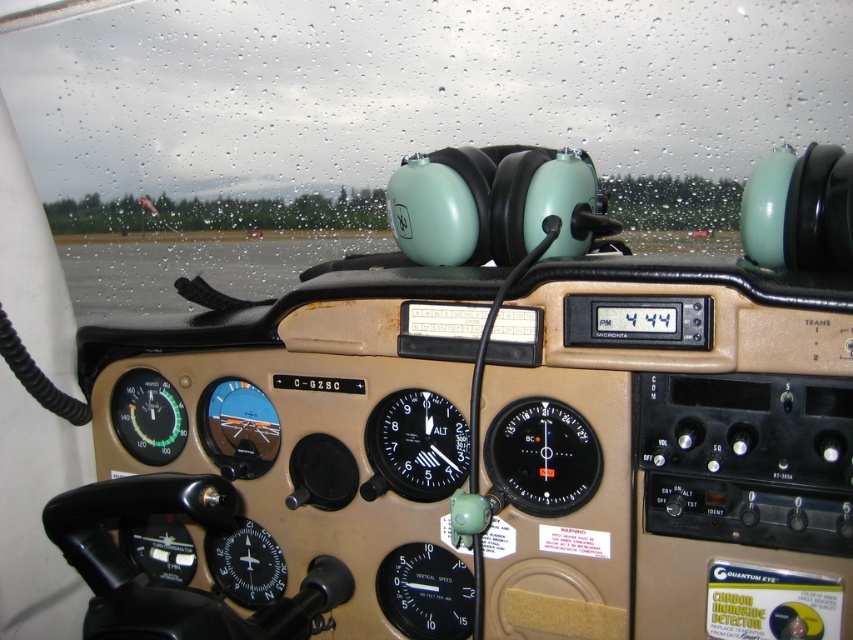
Between black plastic gauge at center and matte black compass at left, which one is positioned lower?

black plastic gauge at center

Between black plastic gauge at center and matte black compass at left, which one appears on the left side from the viewer's perspective?

matte black compass at left

At what (x,y) coordinates should I click in order to perform the action: click on black plastic gauge at center. Please return your answer as a coordinate pair (x, y). This screenshot has height=640, width=853. Looking at the image, I should click on (543, 456).

Locate an element on the screen. The width and height of the screenshot is (853, 640). black plastic gauge at center is located at coordinates (543, 456).

Measure the distance between transparent glass windshield at upper center and black plastic gauge at center.

They are 2.98 meters apart.

Find the location of `transparent glass windshield at upper center`. transparent glass windshield at upper center is located at coordinates click(381, 125).

This screenshot has height=640, width=853. Describe the element at coordinates (381, 125) in the screenshot. I see `transparent glass windshield at upper center` at that location.

Is transparent glass windshield at upper center closer to the viewer compared to matte black compass at left?

No, it is not.

Is point (646, 179) farther from camera compared to point (125, 396)?

Yes, it is.

Find the location of a particular element. Image resolution: width=853 pixels, height=640 pixels. transparent glass windshield at upper center is located at coordinates pos(381,125).